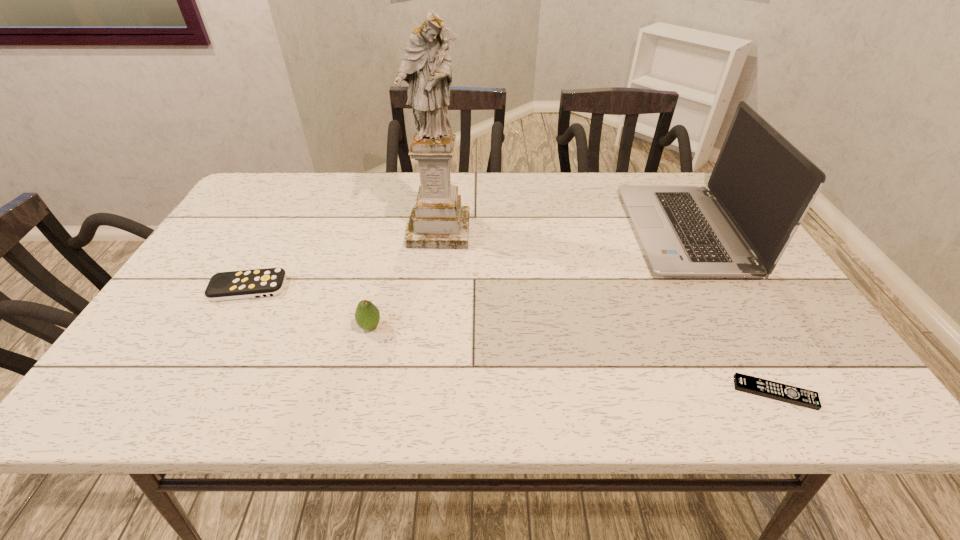
Where is `laptop computer at the right edge`? This screenshot has width=960, height=540. laptop computer at the right edge is located at coordinates (761, 187).

At what (x,y) coordinates should I click in order to perform the action: click on remote control present at the right edge. Please return your answer as a coordinate pair (x, y). Looking at the image, I should click on (769, 389).

This screenshot has height=540, width=960. What are the coordinates of `object positioned at the far right corner` in the screenshot? It's located at (761, 187).

Image resolution: width=960 pixels, height=540 pixels. Identify the location of object situated at the near right corner. pos(769,389).

This screenshot has width=960, height=540. I want to click on free point at the far edge, so click(x=608, y=184).

Find the location of a particular element. This screenshot has width=960, height=540. free spot at the left edge of the desktop is located at coordinates (239, 221).

This screenshot has width=960, height=540. In order to click on vacant region at the right edge of the desktop in this screenshot , I will do `click(734, 325)`.

Image resolution: width=960 pixels, height=540 pixels. In the image, there is a desktop. Find the location of `free space at the far left corner`. free space at the far left corner is located at coordinates (284, 210).

Locate an element on the screen. This screenshot has width=960, height=540. free space at the near left corner is located at coordinates (127, 388).

At what (x,y) coordinates should I click in order to perform the action: click on vacant space that is in between the third tallest object and the tallest object. Please return your answer as a coordinate pair (x, y). The image size is (960, 540). Looking at the image, I should click on (404, 279).